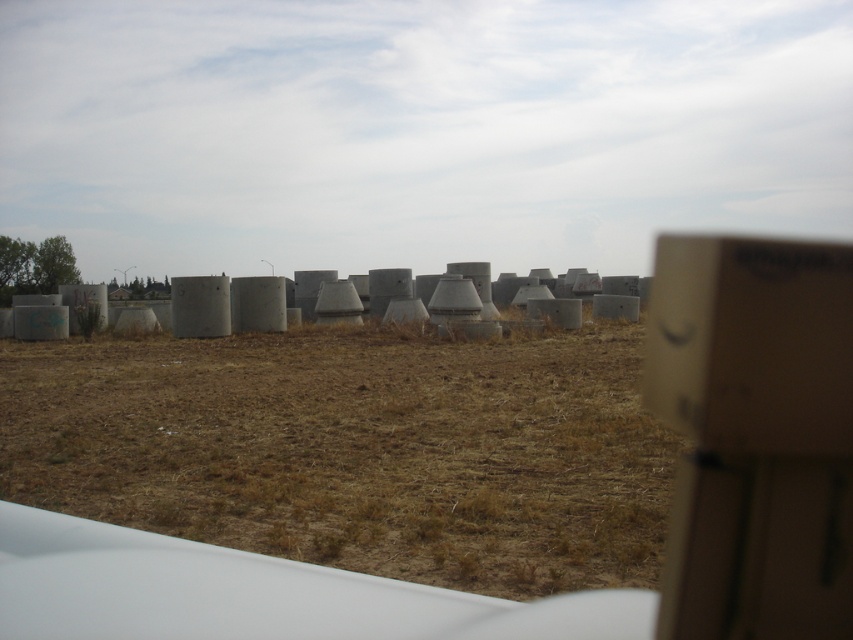
Between point (576, 568) and point (729, 563), which one is positioned behind?

The point (576, 568) is behind.

At what (x,y) coordinates should I click in order to perform the action: click on brown dry grass at center. Please return your answer as a coordinate pair (x, y). Looking at the image, I should click on (357, 449).